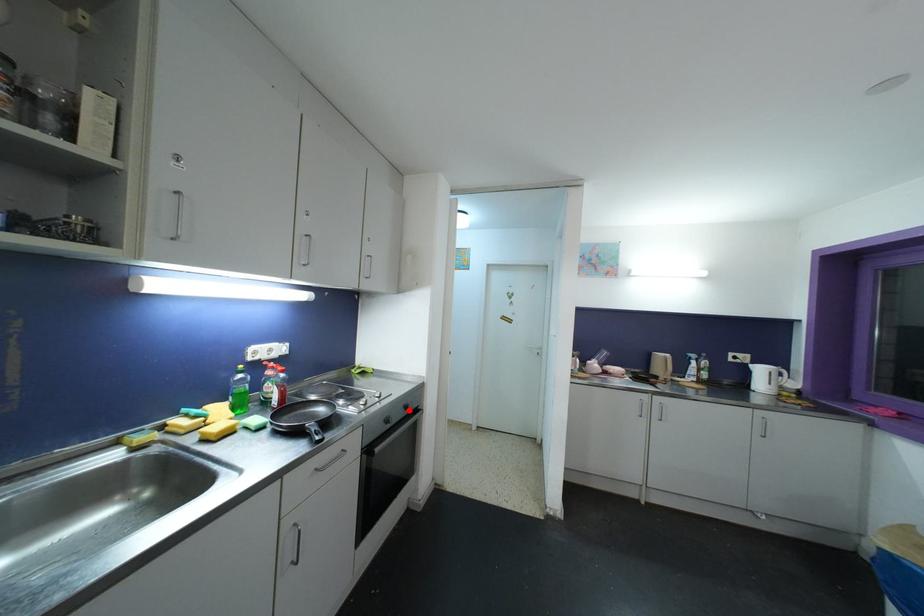
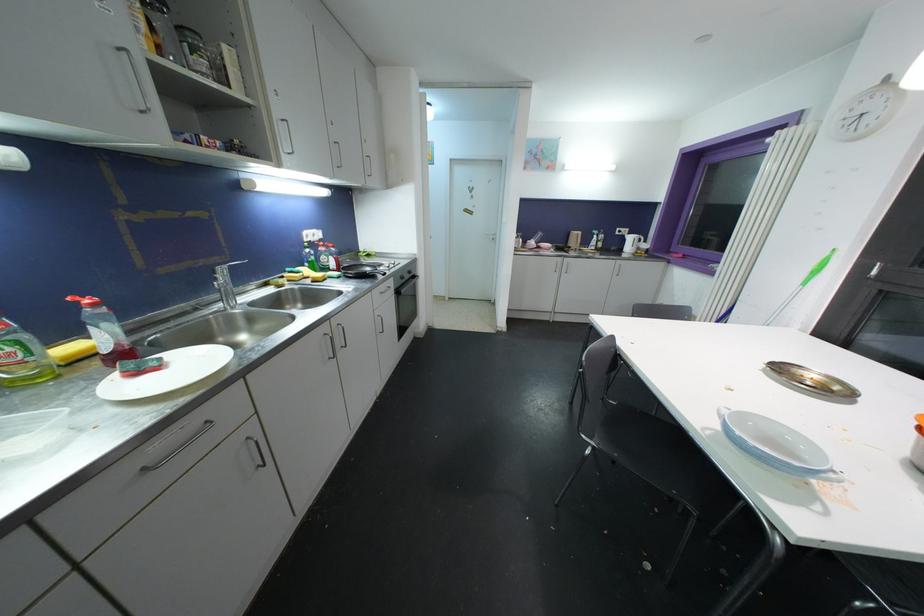
Question: A red point is marked in image1. In image2, is the corresponding 3D point closer to the camera or farther? Reply with the corresponding letter.

Choices:
 (A) The corresponding 3D point is closer.
 (B) The corresponding 3D point is farther.

Answer: (A)